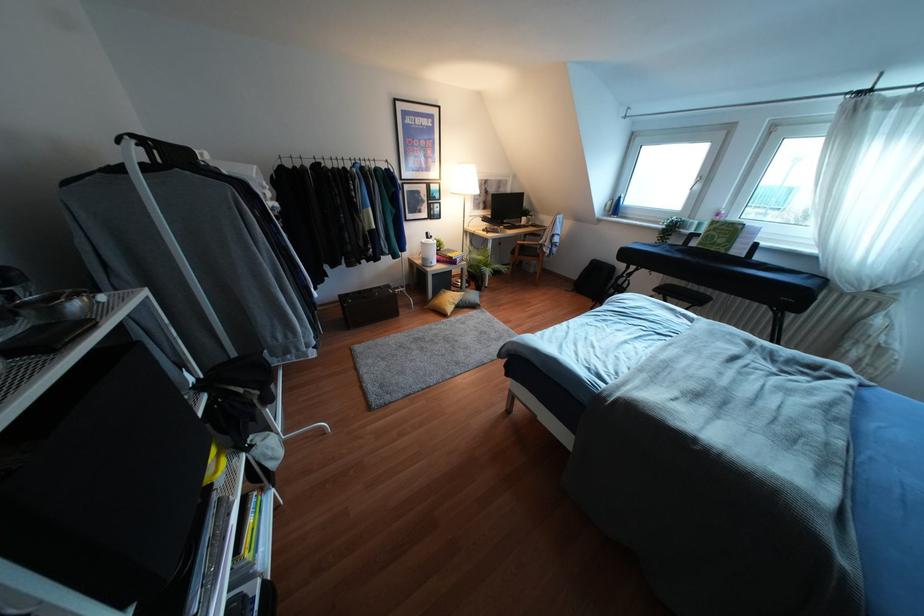
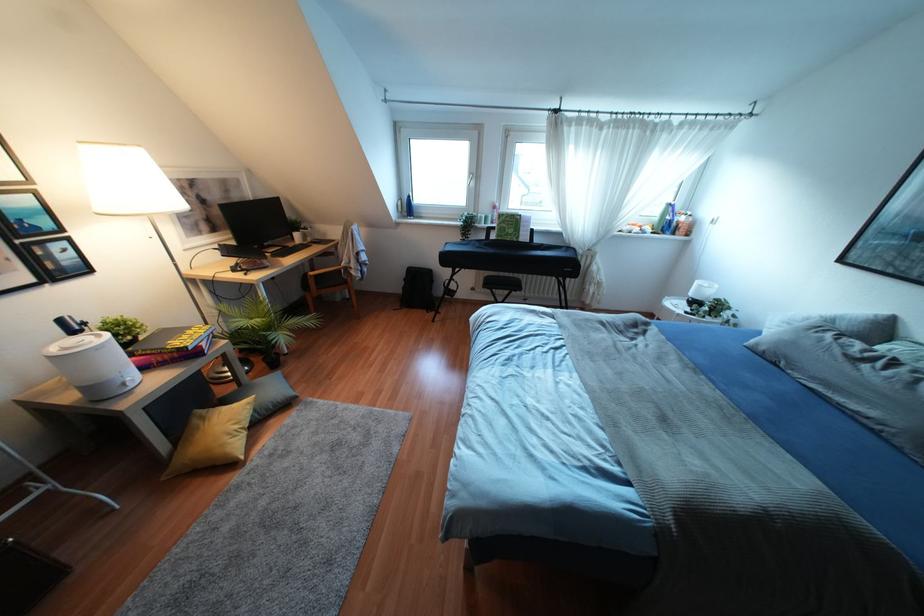
Question: The camera is either moving clockwise (left) or counter-clockwise (right) around the object. The first image is from the beginning of the video and the second image is from the end. Is the camera moving left or right when shooting the video?

Choices:
 (A) Left
 (B) Right

Answer: (A)